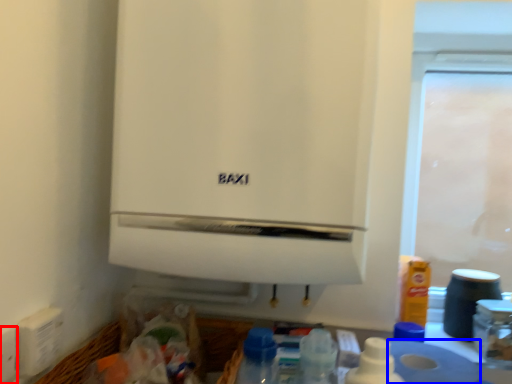
Question: Which object appears farthest to the camera in this image, electric outlet (highlighted by a red box) or toilet paper (highlighted by a blue box)?

Choices:
 (A) electric outlet
 (B) toilet paper

Answer: (B)